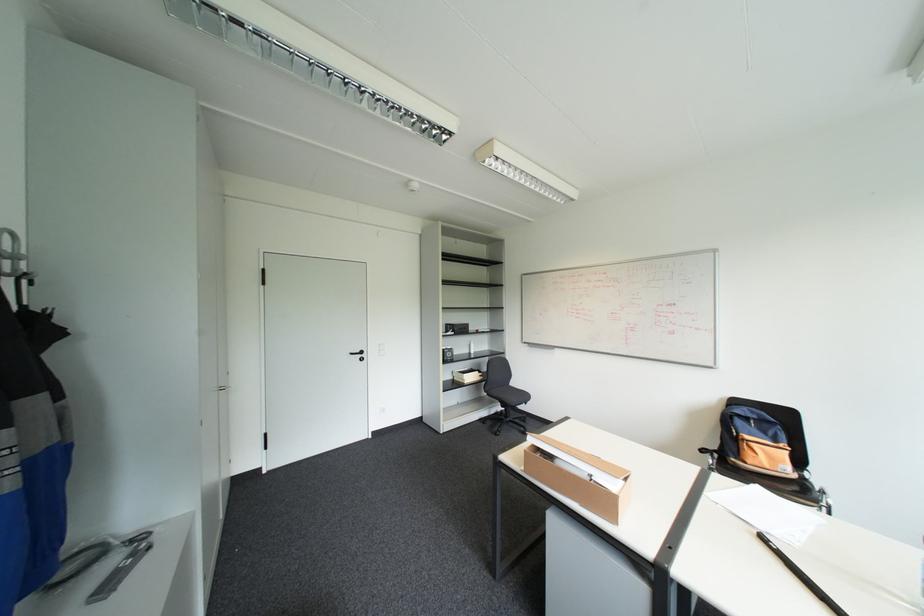
This screenshot has width=924, height=616. I want to click on black door handle, so click(359, 354).